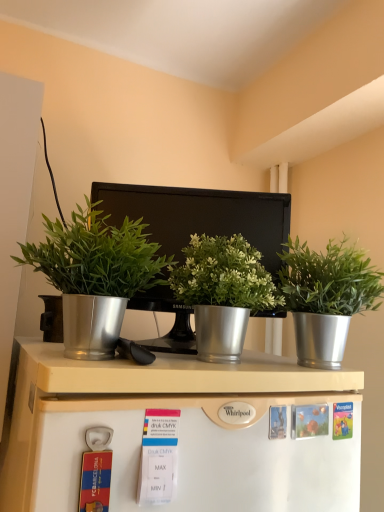
Question: From the image's perspective, is metallic silver monitor at center on metallic silver plant pot at left, positioned as the third houseplant in right-to-left order?

Choices:
 (A) yes
 (B) no

Answer: (B)

Question: Is metallic silver monitor at center positioned before metallic silver plant pot at left, positioned as the third houseplant in right-to-left order?

Choices:
 (A) yes
 (B) no

Answer: (B)

Question: Does metallic silver monitor at center touch metallic silver plant pot at left, positioned as the 1th houseplant in left-to-right order?

Choices:
 (A) yes
 (B) no

Answer: (B)

Question: Is metallic silver monitor at center oriented away from metallic silver plant pot at left, positioned as the third houseplant in right-to-left order?

Choices:
 (A) yes
 (B) no

Answer: (B)

Question: Considering the relative sizes of metallic silver monitor at center and metallic silver plant pot at left, positioned as the third houseplant in right-to-left order, in the image provided, is metallic silver monitor at center shorter than metallic silver plant pot at left, positioned as the third houseplant in right-to-left order,?

Choices:
 (A) no
 (B) yes

Answer: (A)

Question: Choose the correct answer: Is white matte refrigerator at lower center inside metallic silver plant pot at left, positioned as the 1th houseplant in left-to-right order, or outside it?

Choices:
 (A) outside
 (B) inside

Answer: (A)

Question: Considering the positions of white matte refrigerator at lower center and metallic silver plant pot at left, positioned as the 1th houseplant in left-to-right order, in the image, is white matte refrigerator at lower center bigger or smaller than metallic silver plant pot at left, positioned as the 1th houseplant in left-to-right order,?

Choices:
 (A) big
 (B) small

Answer: (B)

Question: From the image's perspective, is white matte refrigerator at lower center above or below metallic silver plant pot at left, positioned as the 1th houseplant in left-to-right order?

Choices:
 (A) above
 (B) below

Answer: (B)

Question: Considering the relative positions of white matte refrigerator at lower center and metallic silver plant pot at left, positioned as the 1th houseplant in left-to-right order, in the image provided, is white matte refrigerator at lower center to the left or to the right of metallic silver plant pot at left, positioned as the 1th houseplant in left-to-right order,?

Choices:
 (A) right
 (B) left

Answer: (A)

Question: Is metallic silver monitor at center taller or shorter than white matte refrigerator at lower center?

Choices:
 (A) tall
 (B) short

Answer: (A)

Question: Considering the positions of metallic silver monitor at center and white matte refrigerator at lower center in the image, is metallic silver monitor at center bigger or smaller than white matte refrigerator at lower center?

Choices:
 (A) small
 (B) big

Answer: (B)

Question: Based on their positions, is metallic silver monitor at center located to the left or right of white matte refrigerator at lower center?

Choices:
 (A) left
 (B) right

Answer: (A)

Question: Considering the positions of metallic silver monitor at center and white matte refrigerator at lower center in the image, is metallic silver monitor at center wider or thinner than white matte refrigerator at lower center?

Choices:
 (A) wide
 (B) thin

Answer: (A)

Question: From a real-world perspective, relative to metallic silver monitor at center, is metallic silver plant pot at left, positioned as the third houseplant in right-to-left order, vertically above or below?

Choices:
 (A) below
 (B) above

Answer: (A)

Question: In terms of width, does metallic silver plant pot at left, positioned as the third houseplant in right-to-left order, look wider or thinner when compared to metallic silver monitor at center?

Choices:
 (A) wide
 (B) thin

Answer: (A)